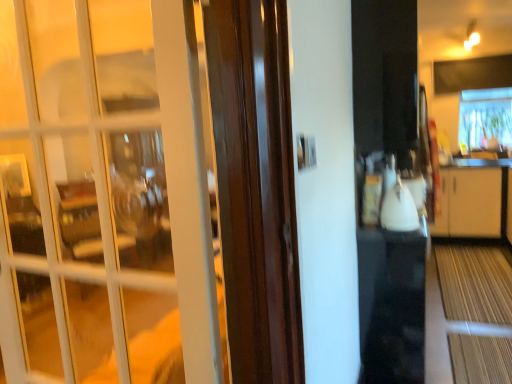
Image resolution: width=512 pixels, height=384 pixels. What do you see at coordinates (396, 201) in the screenshot?
I see `white glossy kettle at center` at bounding box center [396, 201].

The image size is (512, 384). In order to click on transparent plastic window at upper right in this screenshot , I will do `click(485, 120)`.

Image resolution: width=512 pixels, height=384 pixels. Find the location of `white glass door at left`. white glass door at left is located at coordinates (105, 196).

Where is `white glossy kettle at center`? This screenshot has height=384, width=512. white glossy kettle at center is located at coordinates pyautogui.click(x=396, y=201).

Between white glossy kettle at center and white glass door at left, which one appears on the left side from the viewer's perspective?

white glass door at left is more to the left.

Considering the sizes of objects white glossy kettle at center and white glass door at left in the image provided, who is wider, white glossy kettle at center or white glass door at left?

white glossy kettle at center is wider.

How many degrees apart are the facing directions of white glossy kettle at center and white glass door at left?

The facing directions of white glossy kettle at center and white glass door at left are 98.8 degrees apart.

Could you tell me if white glossy kettle at center is facing white glass door at left?

No, white glossy kettle at center is not oriented towards white glass door at left.

Based on the photo, is white glass door at left shorter than white glossy kettle at center?

No, white glass door at left is not shorter than white glossy kettle at center.

Can you tell me how much white glass door at left and white glossy kettle at center differ in facing direction?

white glass door at left and white glossy kettle at center are facing 98.8 degrees away from each other.

From the image's perspective, is white glass door at left on top of white glossy kettle at center?

No.

From a real-world perspective, does white glass door at left stand above white glossy kettle at center?

Yes, from a real-world perspective, white glass door at left is over white glossy kettle at center

How different are the orientations of transparent plastic window at upper right and white glossy kettle at center in degrees?

91.1 degrees separate the facing orientations of transparent plastic window at upper right and white glossy kettle at center.

From a real-world perspective, is transparent plastic window at upper right physically below white glossy kettle at center?

Actually, transparent plastic window at upper right is physically above white glossy kettle at center in the real world.

From the image's perspective, which one is positioned lower, transparent plastic window at upper right or white glossy kettle at center?

white glossy kettle at center appears lower in the image.

Is white glossy kettle at center not inside transparent plastic window at upper right?

Yes.

Which is behind, white glossy kettle at center or transparent plastic window at upper right?

transparent plastic window at upper right is further from the camera.

Which of these two, white glossy kettle at center or transparent plastic window at upper right, is thinner?

With smaller width is white glossy kettle at center.

From the image's perspective, which one is positioned higher, white glossy kettle at center or transparent plastic window at upper right?

transparent plastic window at upper right is shown above in the image.

From a real-world perspective, does transparent plastic window at upper right sit lower than white glass door at left?

No, from a real-world perspective, transparent plastic window at upper right is not under white glass door at left.

Would you say transparent plastic window at upper right is a long distance from white glass door at left?

Indeed, transparent plastic window at upper right is not near white glass door at left.

Between transparent plastic window at upper right and white glass door at left, which one is positioned in front?

white glass door at left is in front.

From the picture: Which of these two, transparent plastic window at upper right or white glass door at left, is smaller?

Smaller between the two is white glass door at left.

Considering the sizes of objects white glass door at left and transparent plastic window at upper right in the image provided, who is wider, white glass door at left or transparent plastic window at upper right?

transparent plastic window at upper right is wider.

Which point is more distant from viewer, (188, 94) or (480, 102)?

The point (480, 102) is farther.

I want to click on window behind the white glass door at left, so point(485,120).

Is white glass door at left in front of or behind transparent plastic window at upper right in the image?

Clearly, white glass door at left is in front of transparent plastic window at upper right.

Locate an element on the screen. The width and height of the screenshot is (512, 384). appliance above the white glass door at left (from the image's perspective) is located at coordinates click(396, 201).

Find the location of a particular element. appliance on the right side of white glass door at left is located at coordinates (396, 201).

When comparing their distances from white glass door at left, does transparent plastic window at upper right or white glossy kettle at center seem closer?

Based on the image, white glossy kettle at center appears to be nearer to white glass door at left.

In the scene shown: Estimate the real-world distances between objects in this image. Which object is further from transparent plastic window at upper right, white glossy kettle at center or white glass door at left?

white glass door at left is further to transparent plastic window at upper right.

Considering their positions, is white glossy kettle at center positioned further to white glass door at left than transparent plastic window at upper right?

The object further to white glass door at left is transparent plastic window at upper right.

Considering their positions, is white glass door at left positioned further to white glossy kettle at center than transparent plastic window at upper right?

The object further to white glossy kettle at center is transparent plastic window at upper right.

When comparing their distances from white glossy kettle at center, does transparent plastic window at upper right or white glass door at left seem closer?

white glass door at left.

Which object lies nearer to the anchor point transparent plastic window at upper right, white glass door at left or white glossy kettle at center?

Among the two, white glossy kettle at center is located nearer to transparent plastic window at upper right.

Find the location of a particular element. The width and height of the screenshot is (512, 384). appliance between white glass door at left and transparent plastic window at upper right along the z-axis is located at coordinates (396, 201).